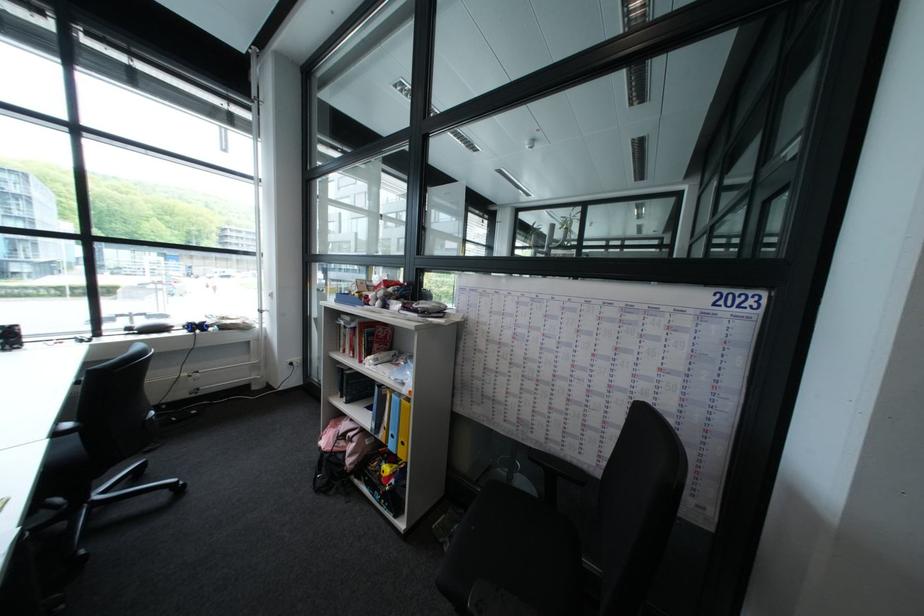
This screenshot has width=924, height=616. What do you see at coordinates (65, 429) in the screenshot?
I see `a black chair armrest` at bounding box center [65, 429].